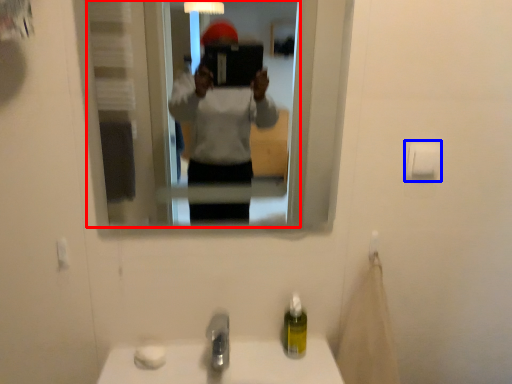
Question: Which of the following is the closest to the observer, mirror (highlighted by a red box) or toilet paper (highlighted by a blue box)?

Choices:
 (A) mirror
 (B) toilet paper

Answer: (A)